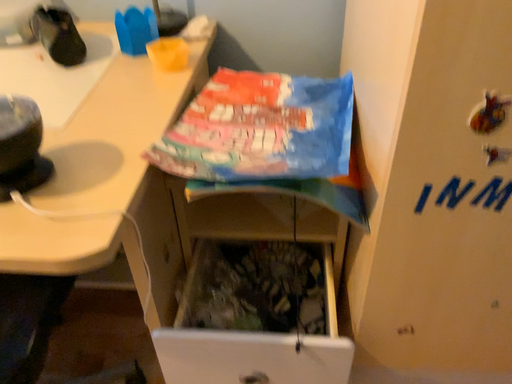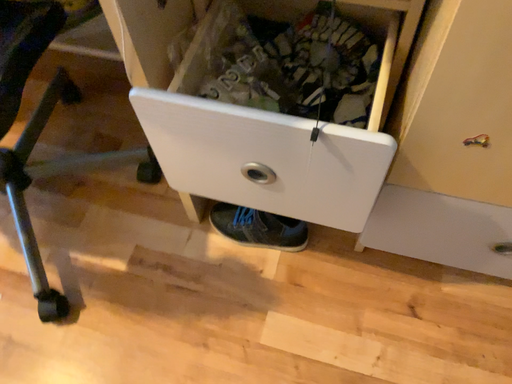
Question: Which way did the camera rotate in the video?

Choices:
 (A) rotated right
 (B) rotated left

Answer: (B)